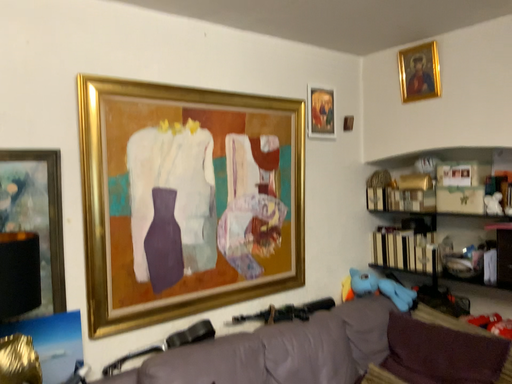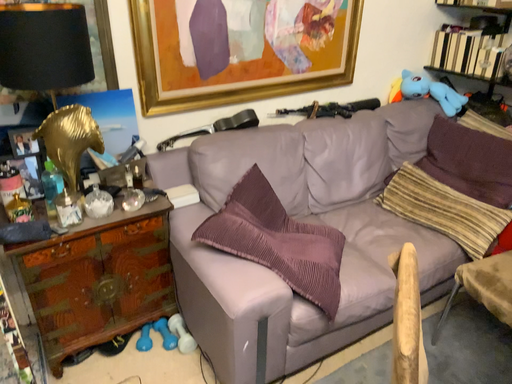
Question: How did the camera likely rotate when shooting the video?

Choices:
 (A) rotated right
 (B) rotated left

Answer: (B)